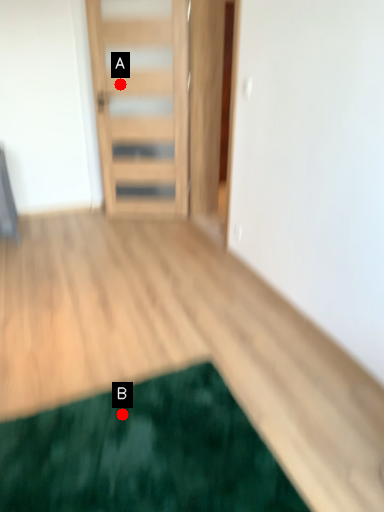
Question: Two points are circled on the image, labeled by A and B beside each circle. Which point is closer to the camera?

Choices:
 (A) A is closer
 (B) B is closer

Answer: (B)